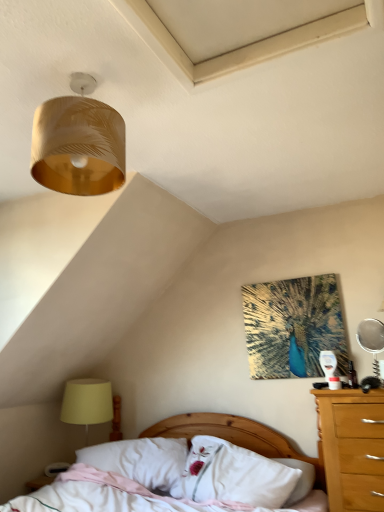
Image resolution: width=384 pixels, height=512 pixels. Find the location of `vacant region above gold textured lampshade at upper left (from a real-world perspective)`. vacant region above gold textured lampshade at upper left (from a real-world perspective) is located at coordinates (78, 79).